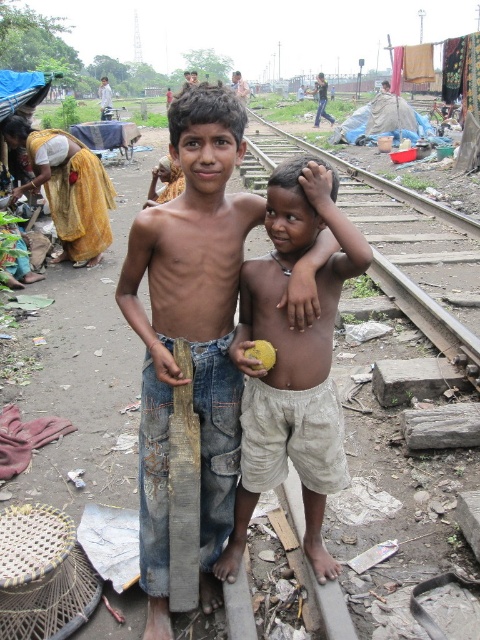
You are a safety inspector reviewing this scene. Based on the image, can you confirm if the wooden plank at center is placed over the light beige shorts at center?

Yes, the wooden plank at center is positioned over the light beige shorts at center as described in the objects description.

Based on the scene description, where is the wooden plank at center located in terms of coordinates?

The wooden plank at center is located at point coordinates of (190,330).

You are a construction worker inspecting the railway tracks. You notice a wooden plank at center and a metal train track at center. Which object is narrower in width?

The wooden plank at center has a lesser width compared to the metal train track at center, so the wooden plank at center is narrower.